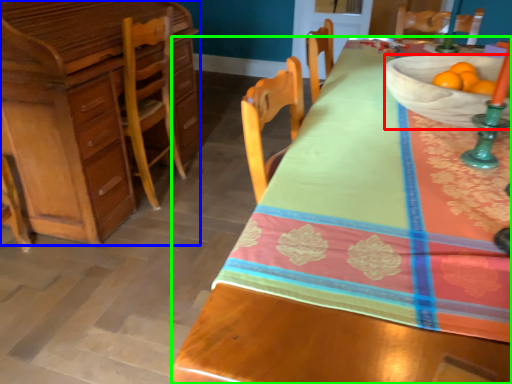
Question: Considering the real-world distances, which object is closest to bowl (highlighted by a red box)? cabinetry (highlighted by a blue box) or desk (highlighted by a green box).

Choices:
 (A) cabinetry
 (B) desk

Answer: (B)